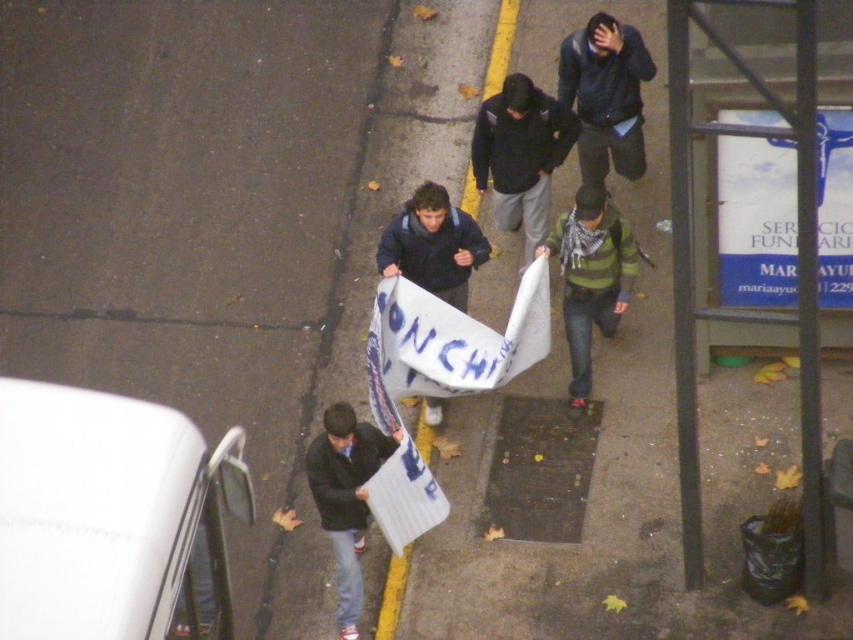
You are a photographer standing at the bus stop on the right side of the sidewalk. You want to take a photo of the dark gray hoodie at center. Which direction should you face to capture it in your shot?

The dark gray hoodie at center is located at point (520, 154), so you should face towards the center of the sidewalk to capture it in your shot.

You are a photographer trying to capture a clear shot of both the dark gray hoodie at center and the green striped sweater at center in the scene. Since you want to ensure both are visible, which clothing item should you focus on first to account for their size difference?

The dark gray hoodie at center is larger than the green striped sweater at center, so you should focus on the dark gray hoodie at center first to ensure it is in clear focus before adjusting for the smaller green striped sweater at center.

From the picture: You are a photographer standing at the camera position. You want to take a photo of the dark gray hoodie at center so that it appears larger in the photo. What should you do?

To make the dark gray hoodie at center appear larger in the photo, you should move closer to it since it is currently 10.02 meters away from the camera.